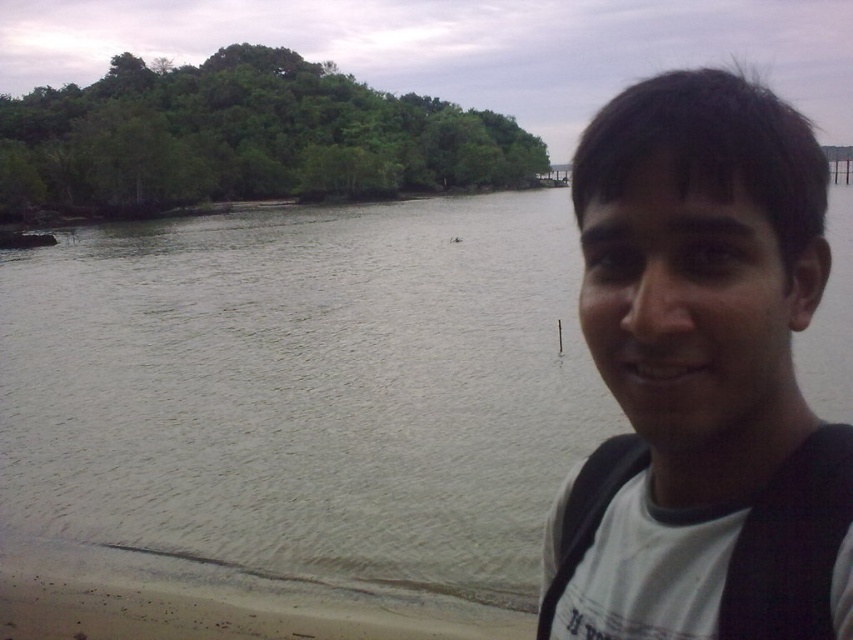
Does point (358, 371) come farther from viewer compared to point (776, 300)?

That is True.

Who is more distant from viewer, (357, 586) or (793, 392)?

The point (357, 586) is more distant.

The height and width of the screenshot is (640, 853). What do you see at coordinates (303, 394) in the screenshot? I see `grayish-green water at center` at bounding box center [303, 394].

The image size is (853, 640). I want to click on grayish-green water at center, so click(303, 394).